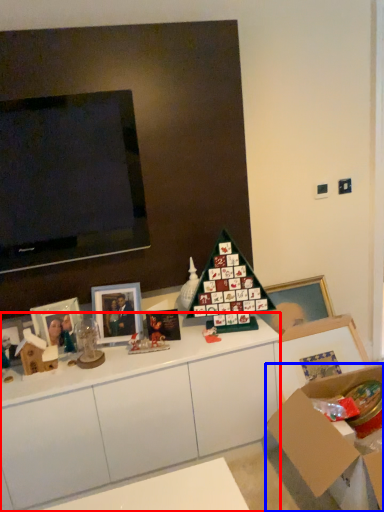
Question: Which of the following is the closest to the observer, cabinetry (highlighted by a red box) or cardboard box (highlighted by a blue box)?

Choices:
 (A) cabinetry
 (B) cardboard box

Answer: (B)